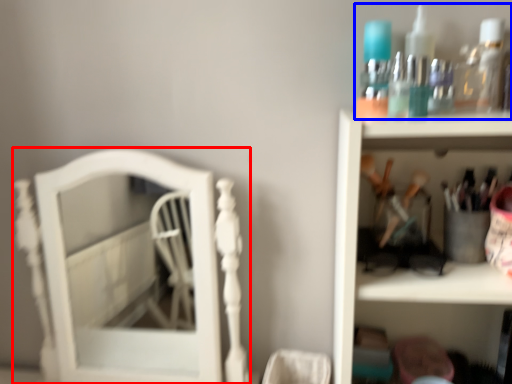
Question: Which object is closer to the camera taking this photo, furniture (highlighted by a red box) or collection (highlighted by a blue box)?

Choices:
 (A) furniture
 (B) collection

Answer: (B)